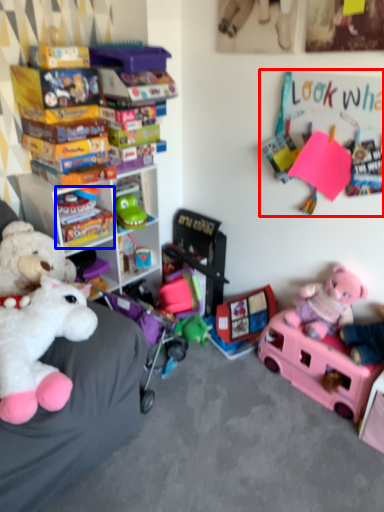
Question: Which object is closer to the camera taking this photo, bulletin board (highlighted by a red box) or toy (highlighted by a blue box)?

Choices:
 (A) bulletin board
 (B) toy

Answer: (A)